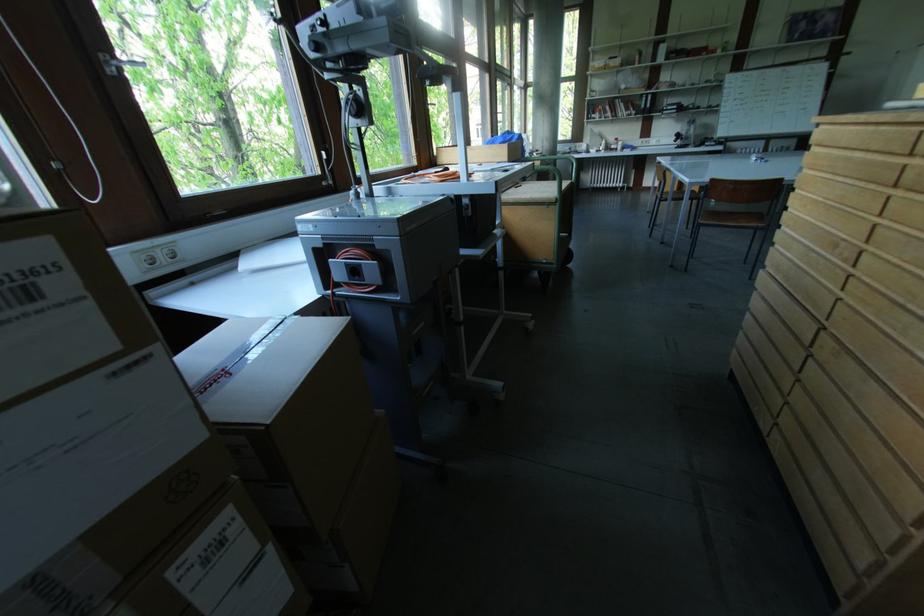
Image resolution: width=924 pixels, height=616 pixels. I want to click on silver window handle, so click(x=119, y=63).